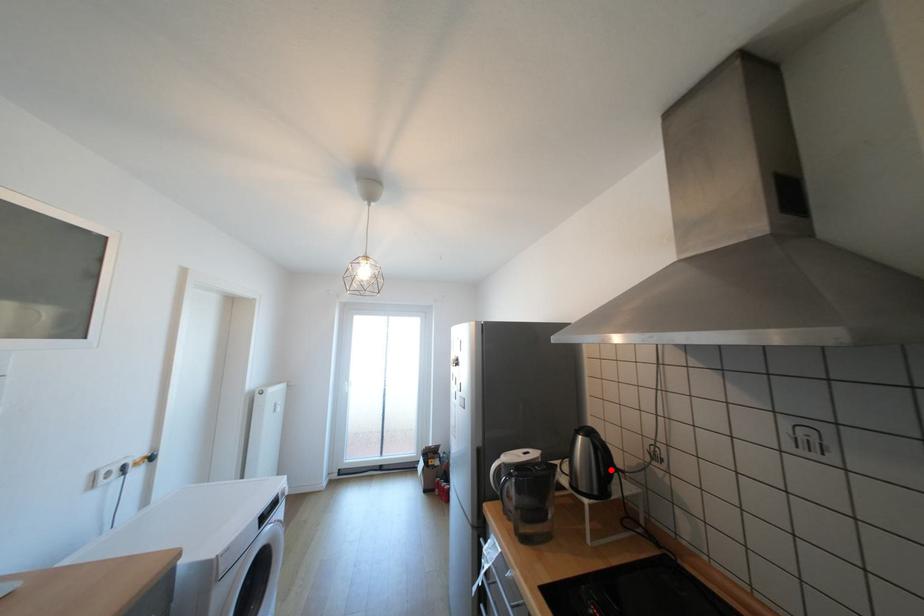
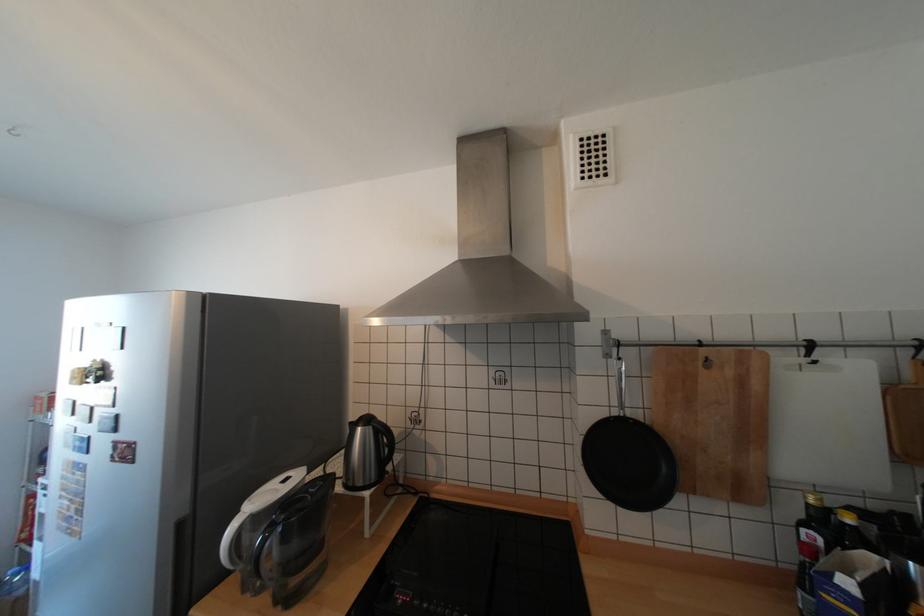
The point at the highlighted location is marked in the first image. Where is the corresponding point in the second image?

(392, 453)